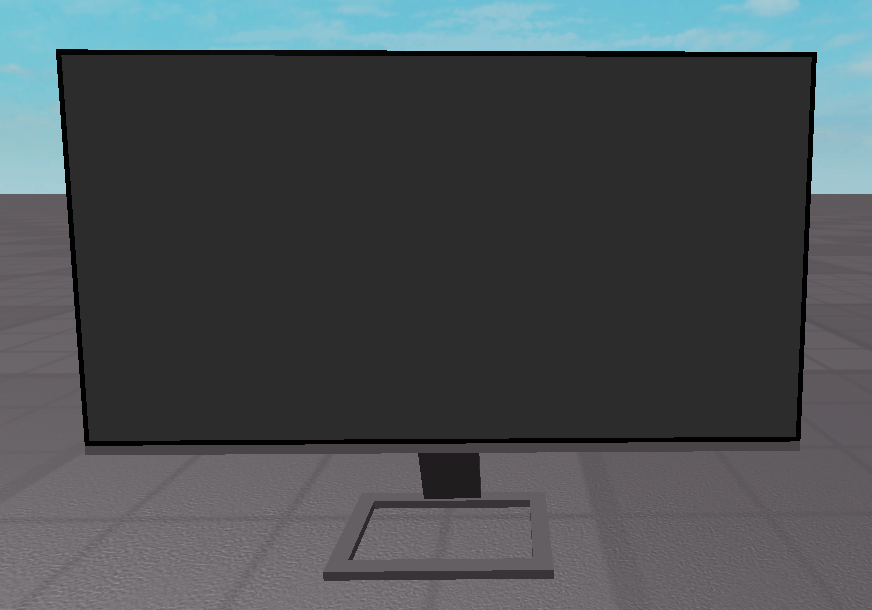
The height and width of the screenshot is (610, 872). I want to click on computer monitor, so click(467, 262).